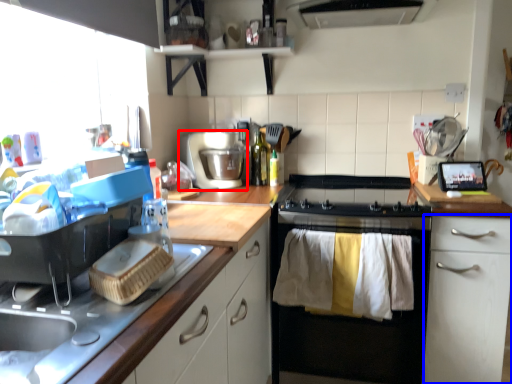
Question: Which object is further to the camera taking this photo, kitchen appliance (highlighted by a red box) or cabinetry (highlighted by a blue box)?

Choices:
 (A) kitchen appliance
 (B) cabinetry

Answer: (A)